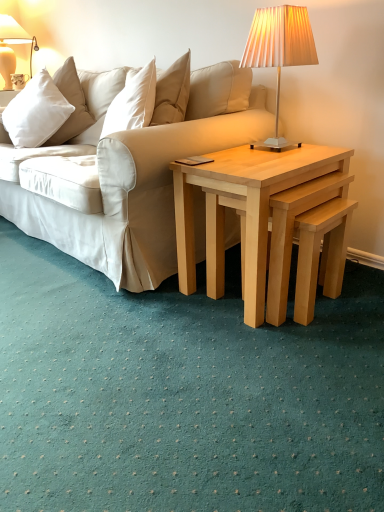
Find the location of `vacant space in front of light wood/natural wood nesting tables at center`. vacant space in front of light wood/natural wood nesting tables at center is located at coordinates (274, 355).